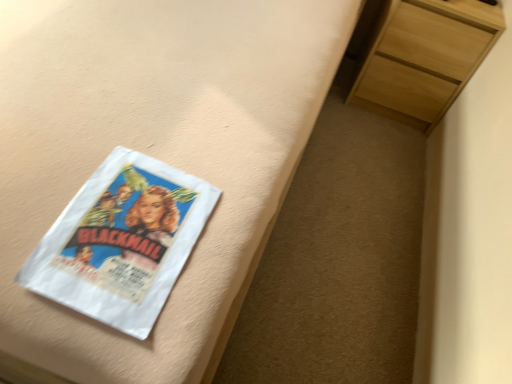
Question: Is matte white bed frame at upper left in front of or behind light wood chest of drawers at upper right in the image?

Choices:
 (A) behind
 (B) front

Answer: (B)

Question: Considering the positions of matte white bed frame at upper left and light wood chest of drawers at upper right in the image, is matte white bed frame at upper left wider or thinner than light wood chest of drawers at upper right?

Choices:
 (A) thin
 (B) wide

Answer: (B)

Question: Estimate the real-world distances between objects in this image. Which object is farther from the light wood chest of drawers at upper right?

Choices:
 (A) matte white bed frame at upper left
 (B) white paper at left

Answer: (B)

Question: Based on their relative distances, which object is nearer to the matte white bed frame at upper left?

Choices:
 (A) light wood chest of drawers at upper right
 (B) white paper at left

Answer: (B)